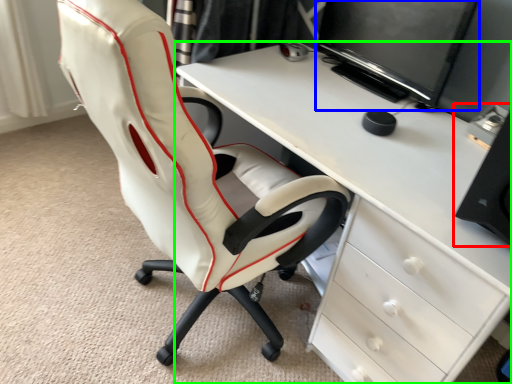
Question: Which object is positioned farthest from computer tower (highlighted by a red box)? Select from computer monitor (highlighted by a blue box) and desk (highlighted by a green box).

Choices:
 (A) computer monitor
 (B) desk

Answer: (A)